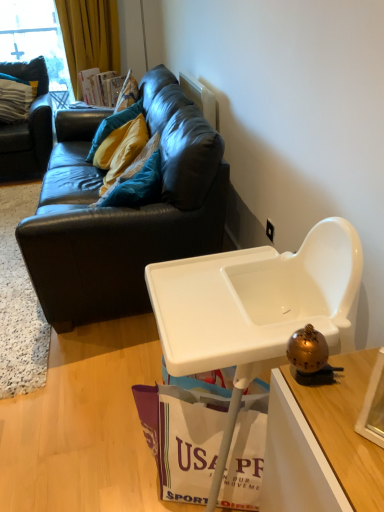
Question: Can you confirm if white paper shopping bag at lower center is taller than teal fabric pillow at upper left, arranged as the second pillow when viewed from the top?

Choices:
 (A) yes
 (B) no

Answer: (B)

Question: Is white paper shopping bag at lower center thinner than teal fabric pillow at upper left, which appears as the first pillow when ordered from the bottom?

Choices:
 (A) yes
 (B) no

Answer: (B)

Question: Can you confirm if white paper shopping bag at lower center is wider than teal fabric pillow at upper left, the first pillow positioned from the front?

Choices:
 (A) no
 (B) yes

Answer: (B)

Question: Is white paper shopping bag at lower center next to teal fabric pillow at upper left, marked as the first pillow in a right-to-left arrangement?

Choices:
 (A) no
 (B) yes

Answer: (A)

Question: Is the position of white paper shopping bag at lower center less distant than that of teal fabric pillow at upper left, the first pillow positioned from the front?

Choices:
 (A) yes
 (B) no

Answer: (A)

Question: Which is correct: teal fabric pillow at upper left, the first pillow from the left, is inside white plastic highchair at lower right, or outside of it?

Choices:
 (A) outside
 (B) inside

Answer: (A)

Question: From a real-world perspective, is teal fabric pillow at upper left, placed as the 2th pillow when sorted from bottom to top, above or below white plastic highchair at lower right?

Choices:
 (A) below
 (B) above

Answer: (B)

Question: Considering the positions of point (24, 117) and point (274, 364), is point (24, 117) closer or farther from the camera than point (274, 364)?

Choices:
 (A) closer
 (B) farther

Answer: (B)

Question: In the image, is teal fabric pillow at upper left, the first pillow from the left, positioned in front of or behind white plastic highchair at lower right?

Choices:
 (A) behind
 (B) front

Answer: (A)

Question: From a real-world perspective, is black leather couch at upper left, which ranks as the 2th studio couch in left-to-right order, above or below white plastic power outlet at upper right?

Choices:
 (A) above
 (B) below

Answer: (A)

Question: Based on their sizes in the image, would you say black leather couch at upper left, the first studio couch positioned from the right, is bigger or smaller than white plastic power outlet at upper right?

Choices:
 (A) big
 (B) small

Answer: (A)

Question: Looking at their shapes, would you say black leather couch at upper left, the first studio couch positioned from the right, is wider or thinner than white plastic power outlet at upper right?

Choices:
 (A) thin
 (B) wide

Answer: (B)

Question: From the image's perspective, relative to white plastic power outlet at upper right, is black leather couch at upper left, which ranks as the 2th studio couch in left-to-right order, above or below?

Choices:
 (A) below
 (B) above

Answer: (B)

Question: In terms of size, does gold metallic bell at right appear bigger or smaller than teal fabric pillow at upper left, arranged as the second pillow when viewed from the top?

Choices:
 (A) small
 (B) big

Answer: (A)

Question: Is gold metallic bell at right wider or thinner than teal fabric pillow at upper left, which appears as the first pillow when ordered from the bottom?

Choices:
 (A) wide
 (B) thin

Answer: (B)